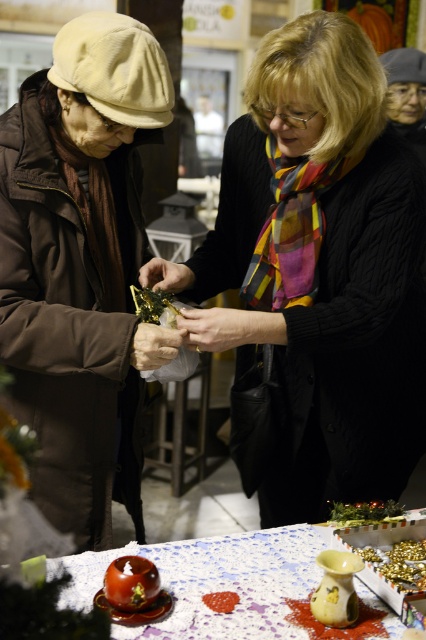
Is shiny brown tomato at lower left below green leafy vegetable at center?

Indeed, shiny brown tomato at lower left is positioned under green leafy vegetable at center.

Between shiny brown tomato at lower left and green leafy vegetable at center, which one appears on the right side from the viewer's perspective?

green leafy vegetable at center

Does point (132, 573) come closer to viewer compared to point (368, 513)?

Yes.

This screenshot has width=426, height=640. I want to click on shiny brown tomato at lower left, so click(131, 582).

Does white textured tablecloth at lower center appear over gold metallic ornament at center?

No, white textured tablecloth at lower center is not above gold metallic ornament at center.

Is white textured tablecloth at lower center further to the viewer compared to gold metallic ornament at center?

No, white textured tablecloth at lower center is closer to the viewer.

In order to click on white textured tablecloth at lower center in this screenshot , I will do `click(213, 580)`.

Between point (164, 276) and point (172, 316), which one is positioned in front?

Point (172, 316) is in front.

Can you confirm if matte gold jewelry at center is wider than gold metallic ornament at center?

Indeed, matte gold jewelry at center has a greater width compared to gold metallic ornament at center.

Between point (184, 282) and point (138, 291), which one is positioned in front?

Positioned in front is point (138, 291).

What are the coordinates of `matte gold jewelry at center` in the screenshot? It's located at (166, 275).